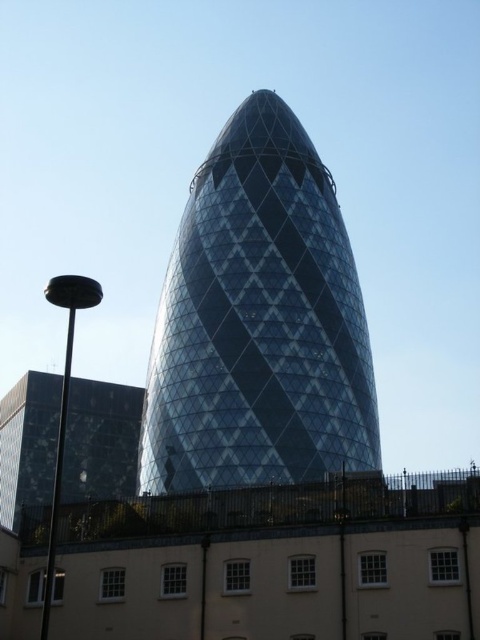
Question: Which point is closer to the camera?

Choices:
 (A) glassy reflective building at lower left
 (B) transparent glass tower at center

Answer: (B)

Question: Among these points, which one is farthest from the camera?

Choices:
 (A) (10, 528)
 (B) (309, 385)

Answer: (A)

Question: Does transparent glass tower at center have a larger size compared to glassy reflective building at lower left?

Choices:
 (A) no
 (B) yes

Answer: (B)

Question: In this image, where is transparent glass tower at center located relative to glassy reflective building at lower left?

Choices:
 (A) left
 (B) right

Answer: (B)

Question: Does transparent glass tower at center lie behind glassy reflective building at lower left?

Choices:
 (A) yes
 (B) no

Answer: (B)